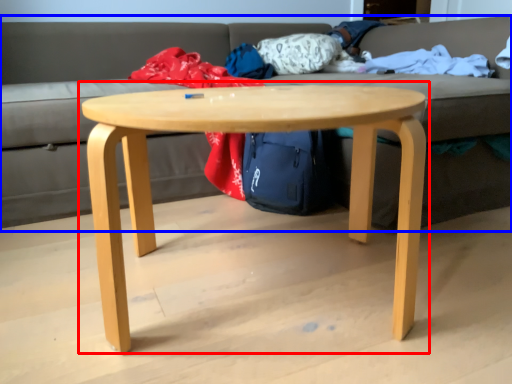
Question: Which object is further to the camera taking this photo, coffee table (highlighted by a red box) or studio couch (highlighted by a blue box)?

Choices:
 (A) coffee table
 (B) studio couch

Answer: (B)